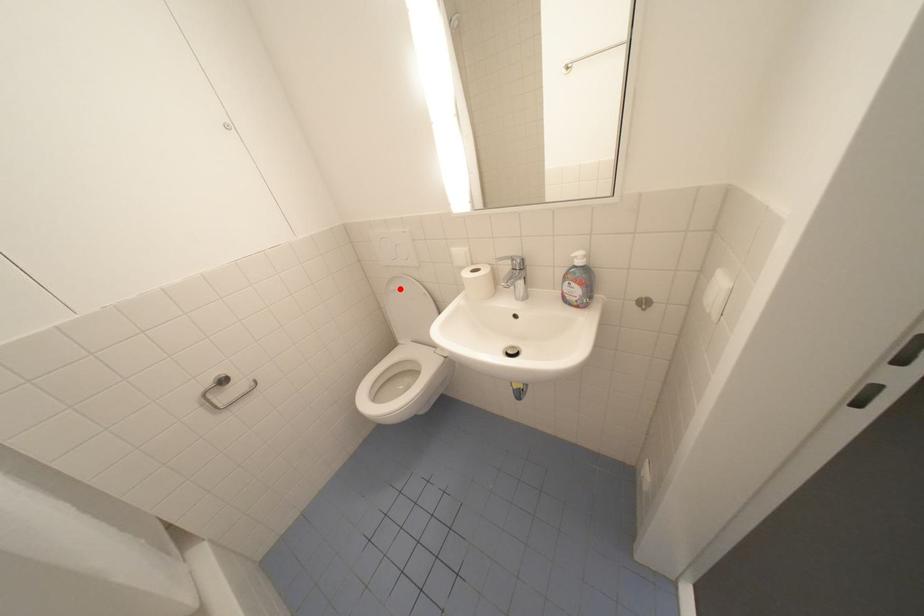
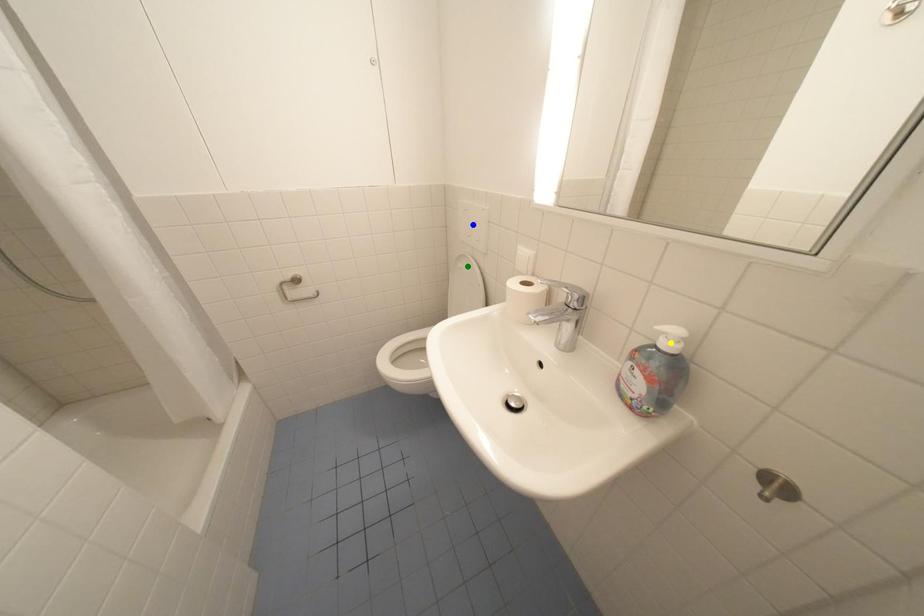
Question: I am providing you with two images of the same scene from different viewpoints. A red point is marked on the first image. You are given multiple points on the second image. Which point in image 2 is actually the same real-world point as the red point in image 1?

Choices:
 (A) green point
 (B) blue point
 (C) yellow point

Answer: (A)